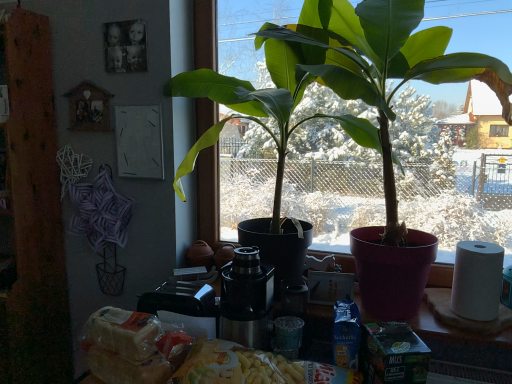
Question: Considering the positions of stainless steel coffee machine at center and yellow matte pasta at lower center in the image, is stainless steel coffee machine at center wider or thinner than yellow matte pasta at lower center?

Choices:
 (A) thin
 (B) wide

Answer: (B)

Question: In the image, is stainless steel coffee machine at center positioned in front of or behind yellow matte pasta at lower center?

Choices:
 (A) behind
 (B) front

Answer: (A)

Question: Which object is positioned closest to the yellow matte pasta at lower center?

Choices:
 (A) white matte paper towel at right
 (B) green matte plant at center
 (C) stainless steel coffee machine at center

Answer: (C)

Question: Estimate the real-world distances between objects in this image. Which object is farther from the white matte paper towel at right?

Choices:
 (A) green matte plant at center
 (B) yellow matte pasta at lower center
 (C) stainless steel coffee machine at center

Answer: (C)